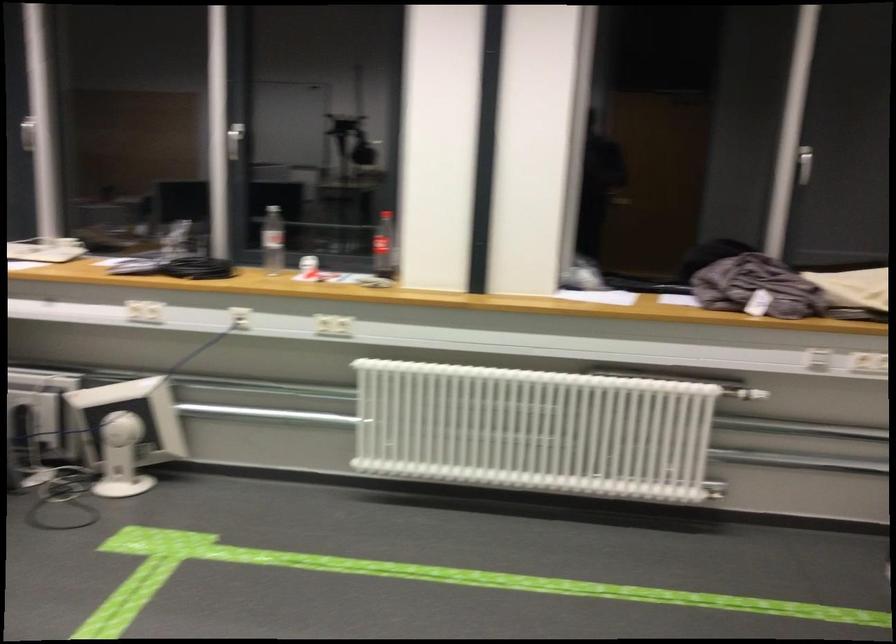
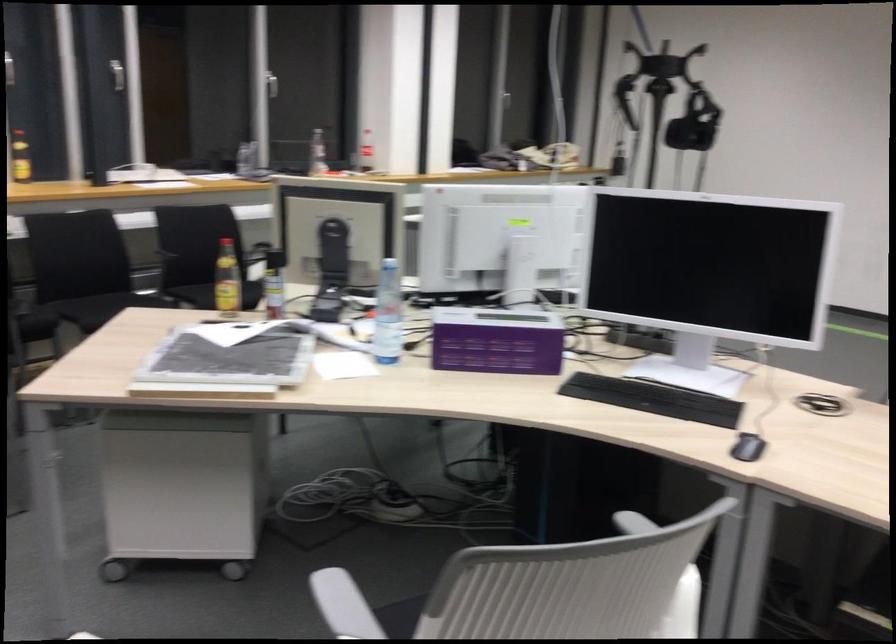
Question: I am providing you with two images of the same scene from different viewpoints. Which of the following objects are not visible in image2?

Choices:
 (A) clear water bottle
 (B) white radiator knob
 (C) lamp height adjuster
 (D) yellow-capped bottle

Answer: (B)